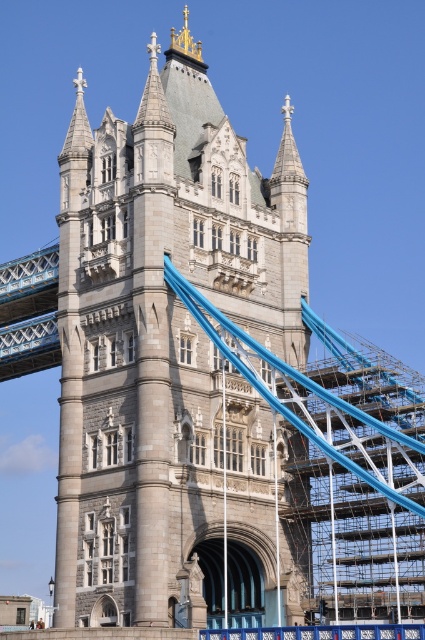
Does gray stone tower at center have a lesser height compared to blue metallic bridge at left?

In fact, gray stone tower at center may be taller than blue metallic bridge at left.

Who is higher up, gray stone tower at center or blue metallic bridge at left?

gray stone tower at center

Find the location of a particular element. This screenshot has height=640, width=425. gray stone tower at center is located at coordinates (170, 355).